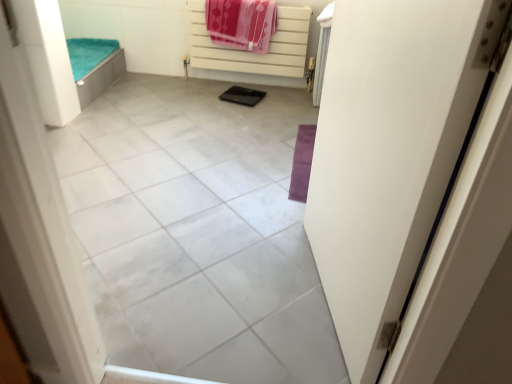
The width and height of the screenshot is (512, 384). What do you see at coordinates (253, 52) in the screenshot?
I see `white matte radiator at upper center` at bounding box center [253, 52].

The width and height of the screenshot is (512, 384). Identify the location of white matte radiator at upper center. click(253, 52).

From a real-world perspective, does white matte door at right stand above gray tile at center?

Yes, from a real-world perspective, white matte door at right is over gray tile at center

Is gray tile at center at the back of white matte door at right?

That's not correct — white matte door at right is not looking away from gray tile at center.

Choose the correct answer: Is white matte door at right inside gray tile at center or outside it?

white matte door at right is spatially situated outside gray tile at center.

From the picture: Between white matte door at right and gray tile at center, which one appears on the left side from the viewer's perspective?

gray tile at center.

Is white matte door at right at the right side of polka dot fabric beach towel at upper center?

Yes, white matte door at right is to the right of polka dot fabric beach towel at upper center.

Consider the image. From their relative heights in the image, would you say white matte door at right is taller or shorter than polka dot fabric beach towel at upper center?

white matte door at right is taller than polka dot fabric beach towel at upper center.

From a real-world perspective, is white matte door at right above or below polka dot fabric beach towel at upper center?

white matte door at right is above polka dot fabric beach towel at upper center.

How distant is white matte door at right from polka dot fabric beach towel at upper center?

white matte door at right and polka dot fabric beach towel at upper center are 6.02 feet apart.

From the image's perspective, is polka dot fabric beach towel at upper center beneath white matte radiator at upper center?

No, from the image's perspective, polka dot fabric beach towel at upper center is not below white matte radiator at upper center.

Consider the image. Is polka dot fabric beach towel at upper center taller than white matte radiator at upper center?

No.

Is polka dot fabric beach towel at upper center facing away from white matte radiator at upper center?

That's right, polka dot fabric beach towel at upper center is facing away from white matte radiator at upper center.

Considering the relative sizes of white matte radiator at upper center and gray tile at center in the image provided, is white matte radiator at upper center shorter than gray tile at center?

Incorrect, the height of white matte radiator at upper center does not fall short of that of gray tile at center.

Considering the relative sizes of white matte radiator at upper center and gray tile at center in the image provided, is white matte radiator at upper center wider than gray tile at center?

No.

In the scene shown: Considering the sizes of objects white matte radiator at upper center and gray tile at center in the image provided, who is bigger, white matte radiator at upper center or gray tile at center?

gray tile at center is bigger.

How different are the orientations of white matte radiator at upper center and white matte door at right in degrees?

The angle between the facing direction of white matte radiator at upper center and the facing direction of white matte door at right is 76.7 degrees.

Is point (194, 18) closer or farther from the camera than point (432, 93)?

Point (194, 18) appears to be farther away from the viewer than point (432, 93).

Based on the photo, is white matte radiator at upper center positioned with its back to white matte door at right?

No, white matte door at right is not at the back of white matte radiator at upper center.

Find the location of a particular element. The image size is (512, 384). balustrade that appears on the left of white matte door at right is located at coordinates (x=253, y=52).

Considering the sizes of objects polka dot fabric beach towel at upper center and gray tile at center in the image provided, who is bigger, polka dot fabric beach towel at upper center or gray tile at center?

With larger size is gray tile at center.

From the image's perspective, which one is positioned lower, polka dot fabric beach towel at upper center or gray tile at center?

gray tile at center, from the image's perspective.

From a real-world perspective, is polka dot fabric beach towel at upper center physically below gray tile at center?

No, from a real-world perspective, polka dot fabric beach towel at upper center is not beneath gray tile at center.

Can you confirm if polka dot fabric beach towel at upper center is thinner than gray tile at center?

Correct, the width of polka dot fabric beach towel at upper center is less than that of gray tile at center.

Based on their sizes in the image, would you say white matte door at right is bigger or smaller than white matte radiator at upper center?

Considering their sizes, white matte door at right takes up more space than white matte radiator at upper center.

Is white matte door at right directly adjacent to white matte radiator at upper center?

No, white matte door at right is not touching white matte radiator at upper center.

Is white matte door at right turned away from white matte radiator at upper center?

That's not correct — white matte door at right is not looking away from white matte radiator at upper center.

Looking at their sizes, would you say white matte door at right is wider or thinner than white matte radiator at upper center?

Considering their sizes, white matte door at right looks broader than white matte radiator at upper center.

In order to click on door on the right of gray tile at center in this screenshot , I will do `click(388, 152)`.

Where is `beach towel that appears above the white matte door at right (from the image's perspective)`? The image size is (512, 384). beach towel that appears above the white matte door at right (from the image's perspective) is located at coordinates (241, 23).

Based on their spatial positions, is polka dot fabric beach towel at upper center or white matte radiator at upper center further from gray tile at center?

The object further to gray tile at center is white matte radiator at upper center.

Estimate the real-world distances between objects in this image. Which object is closer to white matte door at right, white matte radiator at upper center or gray tile at center?

The object closer to white matte door at right is gray tile at center.

Based on their spatial positions, is white matte radiator at upper center or white matte door at right closer to gray tile at center?

The object closer to gray tile at center is white matte door at right.

Estimate the real-world distances between objects in this image. Which object is further from white matte door at right, white matte radiator at upper center or polka dot fabric beach towel at upper center?

The object further to white matte door at right is white matte radiator at upper center.

Which object lies further to the anchor point white matte radiator at upper center, polka dot fabric beach towel at upper center or gray tile at center?

gray tile at center.

Considering their positions, is gray tile at center positioned closer to white matte radiator at upper center than white matte door at right?

gray tile at center is closer to white matte radiator at upper center.

Looking at this image, looking at the image, which one is located closer to white matte door at right, gray tile at center or polka dot fabric beach towel at upper center?

gray tile at center lies closer to white matte door at right than the other object.

When comparing their distances from gray tile at center, does polka dot fabric beach towel at upper center or white matte door at right seem further?

polka dot fabric beach towel at upper center.

Find the location of a particular element. Image resolution: width=512 pixels, height=384 pixels. tile between white matte door at right and white matte radiator at upper center from front to back is located at coordinates [197, 232].

Find the location of a particular element. tile positioned between white matte door at right and polka dot fabric beach towel at upper center from near to far is located at coordinates (197, 232).

Find the location of a particular element. The width and height of the screenshot is (512, 384). beach towel between gray tile at center and white matte radiator at upper center in the front-back direction is located at coordinates (241, 23).

The width and height of the screenshot is (512, 384). Identify the location of beach towel between white matte door at right and white matte radiator at upper center from front to back. click(x=241, y=23).